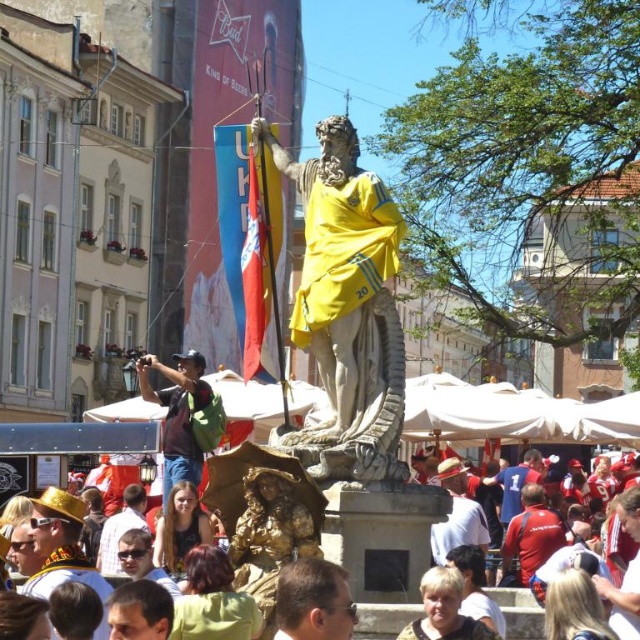
You are a tourist standing at the entrance of the square and want to take a photo of the marble statue at center. Which direction should you walk to get closer to the statue?

The marble statue at center is located at point (346, 307), so you should walk towards the center of the square to get closer to it.